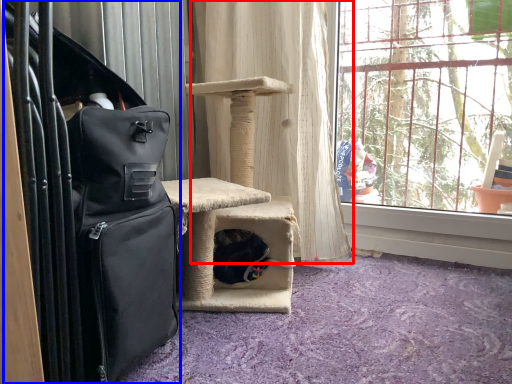
Question: Among these objects, which one is nearest to the camera, curtain (highlighted by a red box) or luggage (highlighted by a blue box)?

Choices:
 (A) curtain
 (B) luggage

Answer: (B)